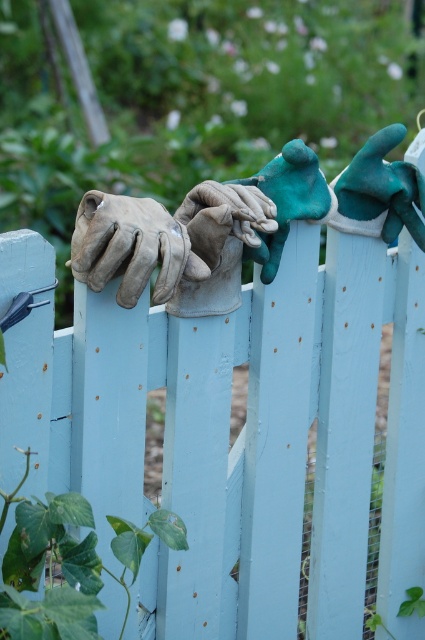
In the scene shown: Is green fabric glove at upper right shorter than green matte glove at center?

Indeed, green fabric glove at upper right has a lesser height compared to green matte glove at center.

Between green fabric glove at upper right and green matte glove at center, which one is positioned lower?

green matte glove at center is lower down.

Between point (357, 195) and point (275, 188), which one is positioned behind?

The point (357, 195) is more distant.

Image resolution: width=425 pixels, height=640 pixels. I want to click on green fabric glove at upper right, so click(x=379, y=192).

Is leather gloves at left smaller than green matte glove at center?

Correct, leather gloves at left occupies less space than green matte glove at center.

Where is `leather gloves at left`? Image resolution: width=425 pixels, height=640 pixels. leather gloves at left is located at coordinates (127, 244).

How far apart are leather gloves at left and green fabric glove at upper right?

20.26 inches

Measure the distance between point (x=91, y=252) and camera.

Point (x=91, y=252) and camera are 5.58 feet apart from each other.

Which is behind, point (158, 230) or point (399, 128)?

Positioned behind is point (399, 128).

Find the location of a particular element. leather gloves at left is located at coordinates (127, 244).